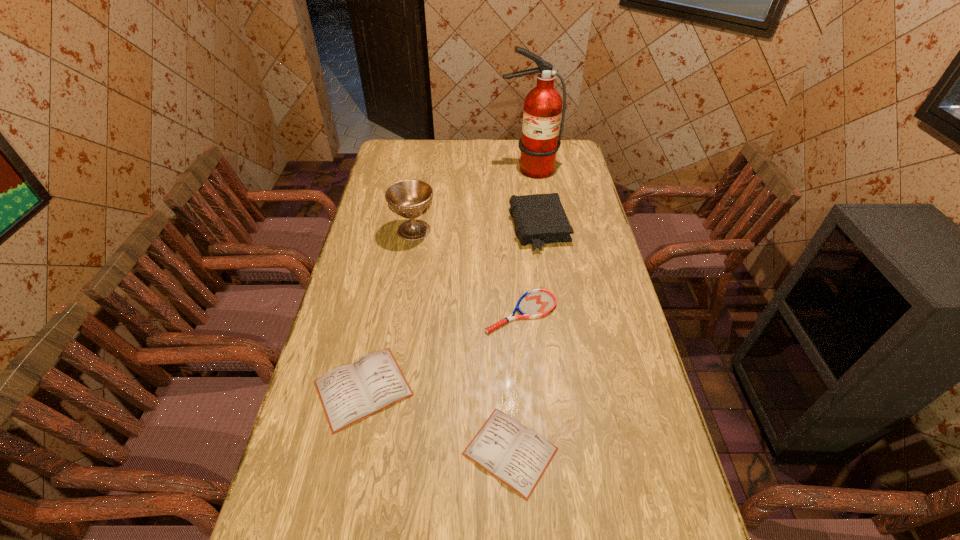
In the current image, all diarys are evenly spaced. To maintain this equal spacing, where should an additional diary be placed on the right? Please point out a free spot. Please provide its 2D coordinates. Your answer should be formatted as a tuple, i.e. [(x, y)], where the tuple contains the x and y coordinates of a point satisfying the conditions above.

[(695, 531)]